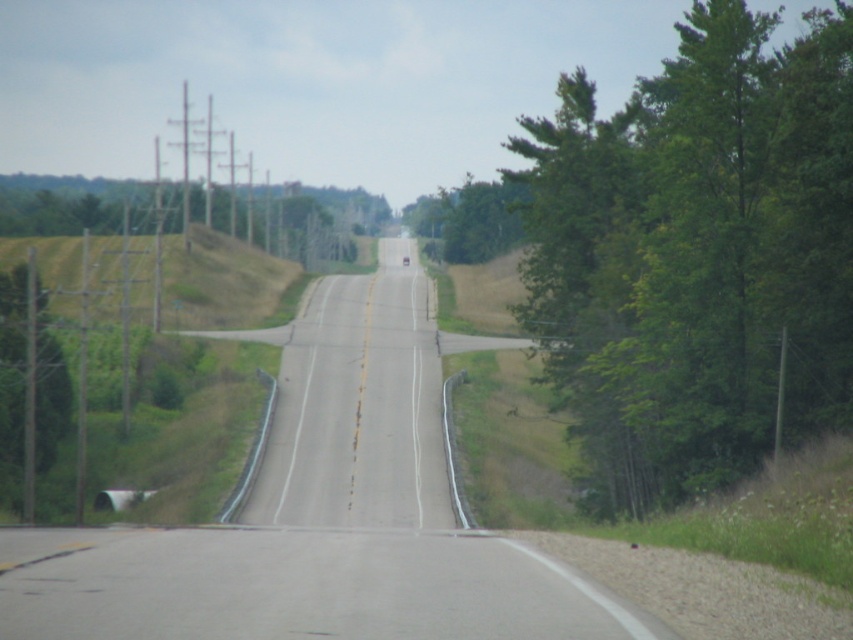
Question: Is green leafy tree at right wider than green leafy tree at left?

Choices:
 (A) yes
 (B) no

Answer: (A)

Question: Does green leafy tree at right appear on the right side of gray asphalt highway at center?

Choices:
 (A) no
 (B) yes

Answer: (B)

Question: Which object is the farthest from the green leafy tree at right?

Choices:
 (A) gray asphalt highway at center
 (B) green leafy tree at left

Answer: (B)

Question: Is green leafy tree at right wider than gray asphalt highway at center?

Choices:
 (A) yes
 (B) no

Answer: (A)

Question: Which point is closer to the camera?

Choices:
 (A) (534, 308)
 (B) (51, 381)
 (C) (376, 272)

Answer: (A)

Question: Which is farther from the green leafy tree at right?

Choices:
 (A) green leafy tree at left
 (B) gray asphalt highway at center

Answer: (A)